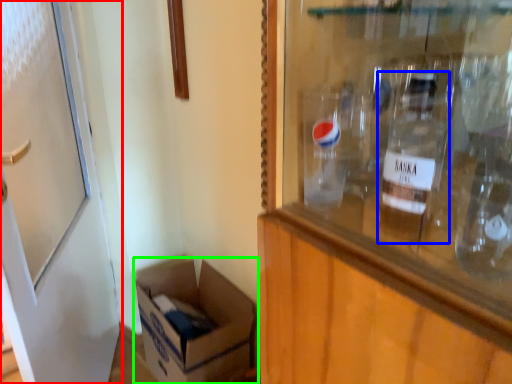
Question: Which is nearer to the door (highlighted by a red box)? bottle (highlighted by a blue box) or box (highlighted by a green box).

Choices:
 (A) bottle
 (B) box

Answer: (B)